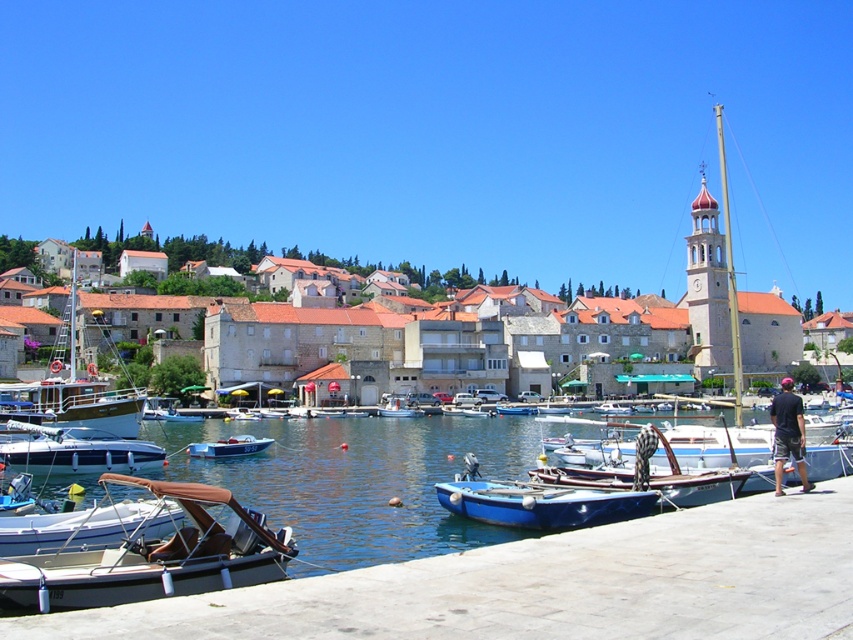
You are standing on a dock and want to board the brown canvas boat at lower left. What are the coordinates of the boat?

The coordinates of the brown canvas boat at lower left are (152, 557).

You are a photographer planning to take a photo of the white plastic boat at lower left and the metallic blue boat at lower left from the dock. Since you want both boats to appear clearly in the frame, which boat should you position closer to the camera to ensure the smaller one isn not overwhelmed by the larger one?

The metallic blue boat at lower left is smaller than the white plastic boat at lower left. To ensure the smaller metallic blue boat at lower left is visible, you should position it closer to the camera so its size in the photo matches the larger white plastic boat at lower left.

You are a photographer standing on the dock and want to capture the blue smooth water at lower center in your shot. According to the coordinates provided, where exactly should you aim your camera to include it?

You should aim your camera at the coordinates point (360, 481) to capture the blue smooth water at lower center.